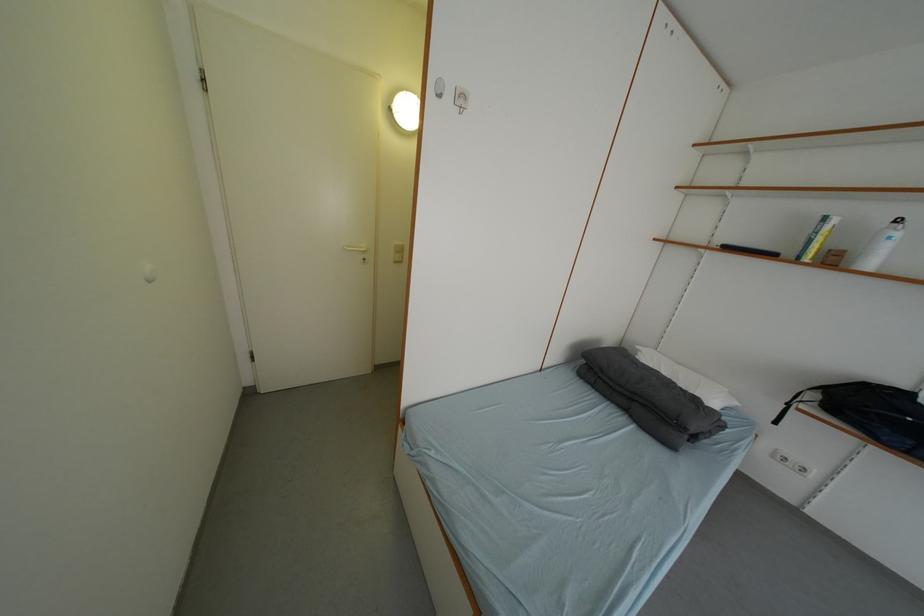
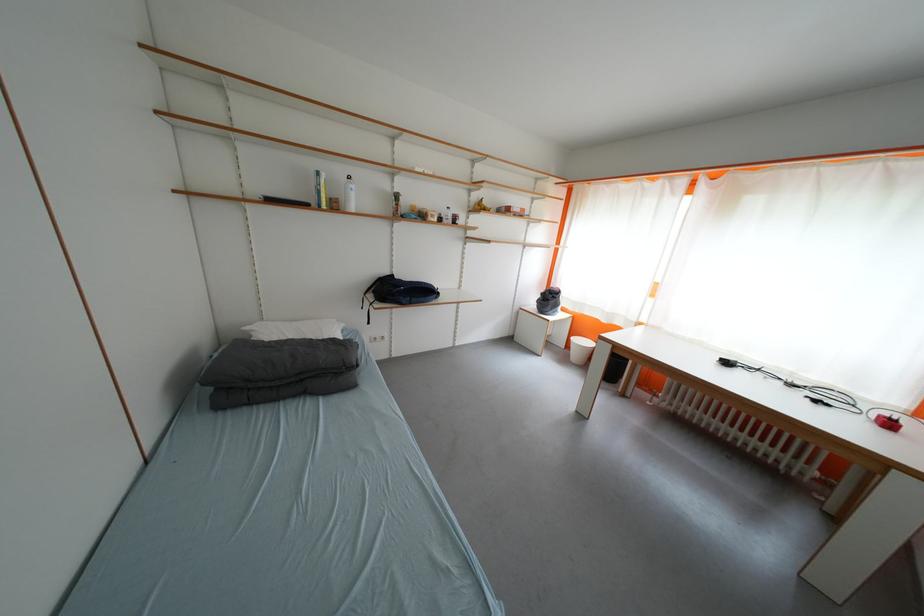
Locate, in the second image, the point that corresponds to [842,264] in the first image.

(344, 209)